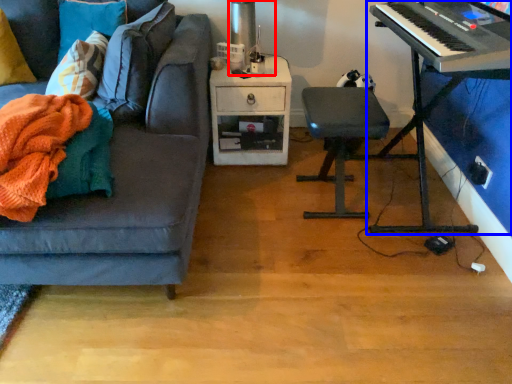
Question: Which of the following is the farthest to the observer, table lamp (highlighted by a red box) or piano (highlighted by a blue box)?

Choices:
 (A) table lamp
 (B) piano

Answer: (A)